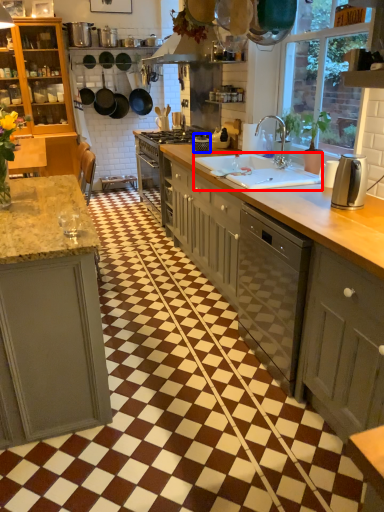
Question: Which object appears farthest to the camera in this image, sink (highlighted by a red box) or appliance (highlighted by a blue box)?

Choices:
 (A) sink
 (B) appliance

Answer: (B)